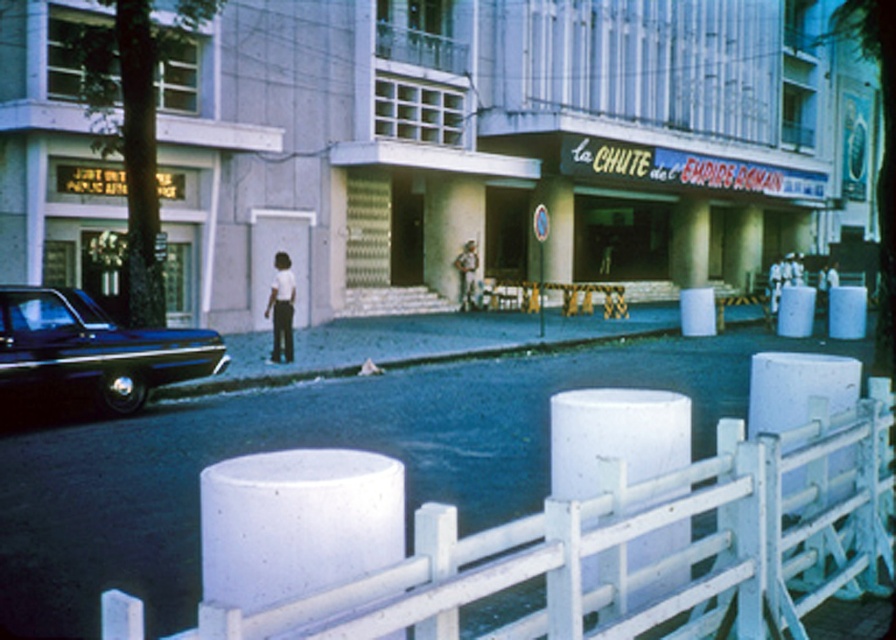
In the scene shown: Does white concrete fence at lower center have a lesser height compared to camouflage fabric uniform at center?

Yes, white concrete fence at lower center is shorter than camouflage fabric uniform at center.

Does white concrete fence at lower center lie behind camouflage fabric uniform at center?

No, it is in front of camouflage fabric uniform at center.

Is point (892, 477) positioned behind point (468, 296)?

No, it is not.

Where is `white concrete fence at lower center`? The width and height of the screenshot is (896, 640). white concrete fence at lower center is located at coordinates (636, 548).

Which is above, matte concrete storefront at center or white concrete fence at lower center?

matte concrete storefront at center is higher up.

Does point (464, 145) come farther from viewer compared to point (810, 532)?

Yes, it is.

Where is `matte concrete storefront at center`? matte concrete storefront at center is located at coordinates (504, 145).

Identify the location of matte concrete storefront at center. tap(504, 145).

Between white matte pants at center and camouflage fabric uniform at center, which one is positioned lower?

white matte pants at center is below.

Between white matte pants at center and camouflage fabric uniform at center, which one has more height?

camouflage fabric uniform at center

Which is behind, point (274, 308) or point (467, 296)?

The point (467, 296) is more distant.

Find the location of a particular element. The width and height of the screenshot is (896, 640). white matte pants at center is located at coordinates (281, 308).